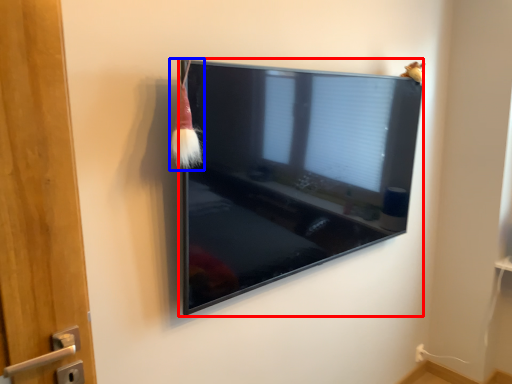
Question: Which of the following is the farthest to the observer, television (highlighted by a red box) or brush (highlighted by a blue box)?

Choices:
 (A) television
 (B) brush

Answer: (A)